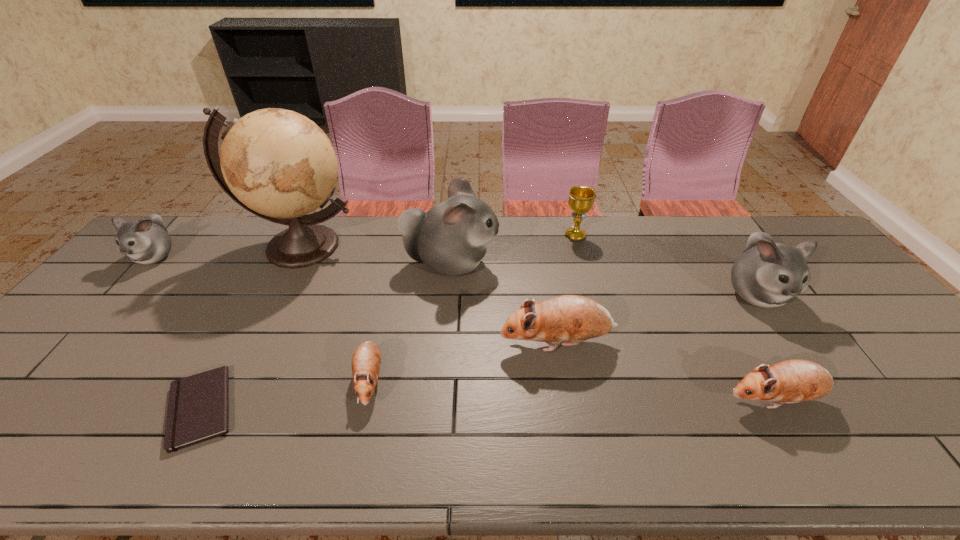
I want to click on globe, so pyautogui.click(x=279, y=165).

Locate an element on the screen. The height and width of the screenshot is (540, 960). the tallest hamster is located at coordinates (451, 239).

This screenshot has width=960, height=540. I want to click on the eighth shortest object, so click(x=451, y=239).

Identify the location of the second smallest white hamster. The height and width of the screenshot is (540, 960). 767,274.

Find the location of a particular element. the fifth shortest hamster is located at coordinates (767, 274).

You are a GUI agent. You are given a task and a screenshot of the screen. Output one action in this format:
    pyautogui.click(x=<x>, y=<y>)
    Task: Click on the gold chalice
    This screenshot has height=540, width=960.
    Given the screenshot: What is the action you would take?
    [x=581, y=199]

Identify the location of the leftmost white hamster. The height and width of the screenshot is (540, 960). (146, 241).

The width and height of the screenshot is (960, 540). In order to click on the smallest white hamster in this screenshot , I will do `click(146, 241)`.

Where is `the biggest brown hamster`? This screenshot has width=960, height=540. the biggest brown hamster is located at coordinates (573, 318).

The image size is (960, 540). In order to click on the seventh tallest object in this screenshot , I will do `click(792, 381)`.